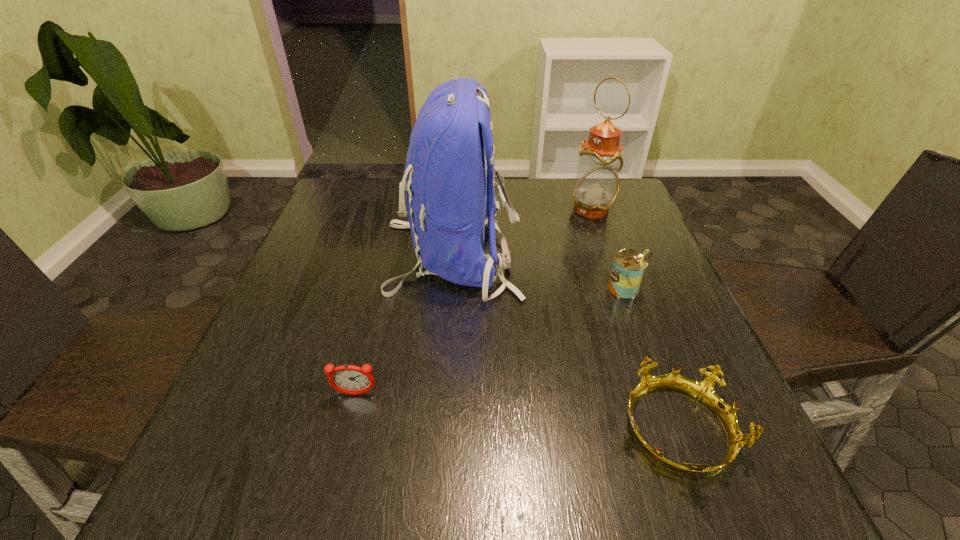
You are a GUI agent. You are given a task and a screenshot of the screen. Output one action in this format:
    pyautogui.click(x=<x>, y=<y>)
    Task: Click on the backpack situated at the far edge
    This screenshot has width=960, height=540.
    Given the screenshot: What is the action you would take?
    pyautogui.click(x=448, y=199)

What are the coordinates of `oil lamp that is at the far edge` in the screenshot? It's located at (596, 188).

The width and height of the screenshot is (960, 540). I want to click on object that is at the near edge, so click(703, 391).

You are a GUI agent. You are given a task and a screenshot of the screen. Output one action in this format:
    pyautogui.click(x=<x>, y=<y>)
    Task: Click on the oil lamp that is at the right edge
    This screenshot has height=540, width=960.
    Given the screenshot: What is the action you would take?
    pyautogui.click(x=596, y=188)

In order to click on can positioned at the right edge in this screenshot , I will do `click(629, 266)`.

At what (x,y) coordinates should I click in order to perform the action: click on crown that is at the right edge. Please return your answer as a coordinate pair (x, y). The image size is (960, 540). Looking at the image, I should click on (703, 391).

Where is `object located in the far right corner section of the desktop`? The image size is (960, 540). object located in the far right corner section of the desktop is located at coordinates (596, 188).

You are a GUI agent. You are given a task and a screenshot of the screen. Output one action in this format:
    pyautogui.click(x=<x>, y=<y>)
    Task: Click on the object that is at the near right corner
    The image size is (960, 540).
    Given the screenshot: What is the action you would take?
    pyautogui.click(x=703, y=391)

Image resolution: width=960 pixels, height=540 pixels. Identify the location of free point at the far edge. (406, 219).

In the image, there is a desktop. At what (x,y) coordinates should I click in order to perform the action: click on vacant space at the near edge. Please return your answer as a coordinate pair (x, y). Looking at the image, I should click on (653, 468).